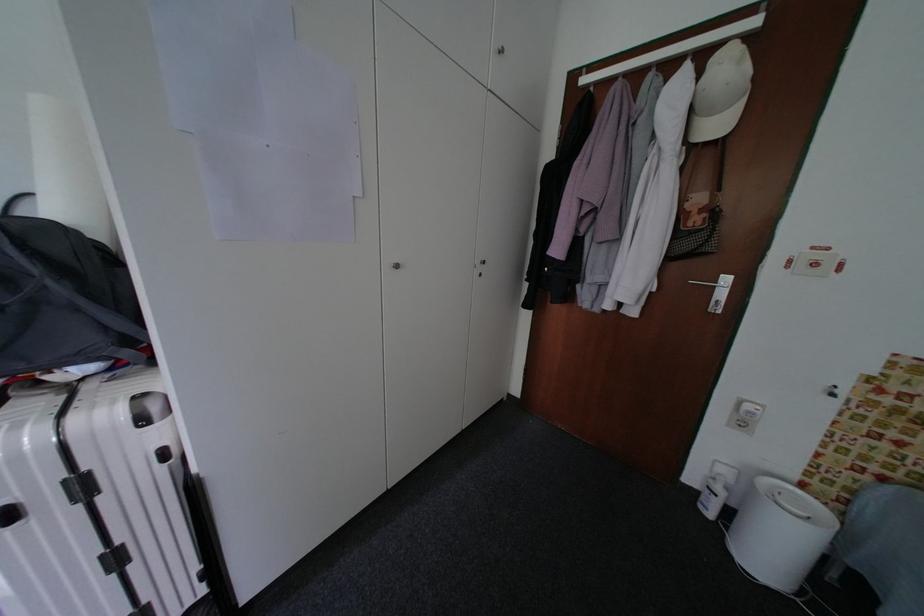
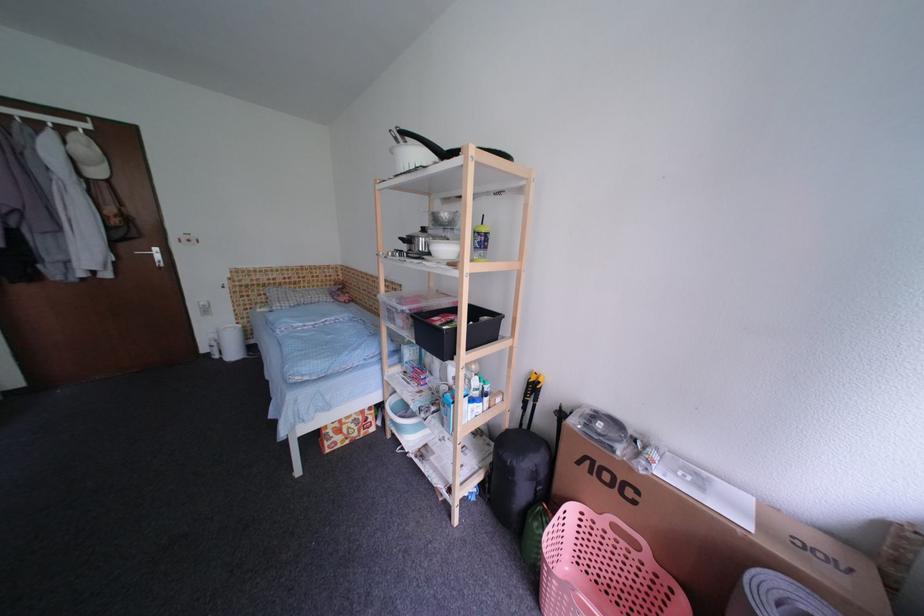
Locate, in the second image, the point that corresponds to the point at 735,476 in the first image.

(222, 338)